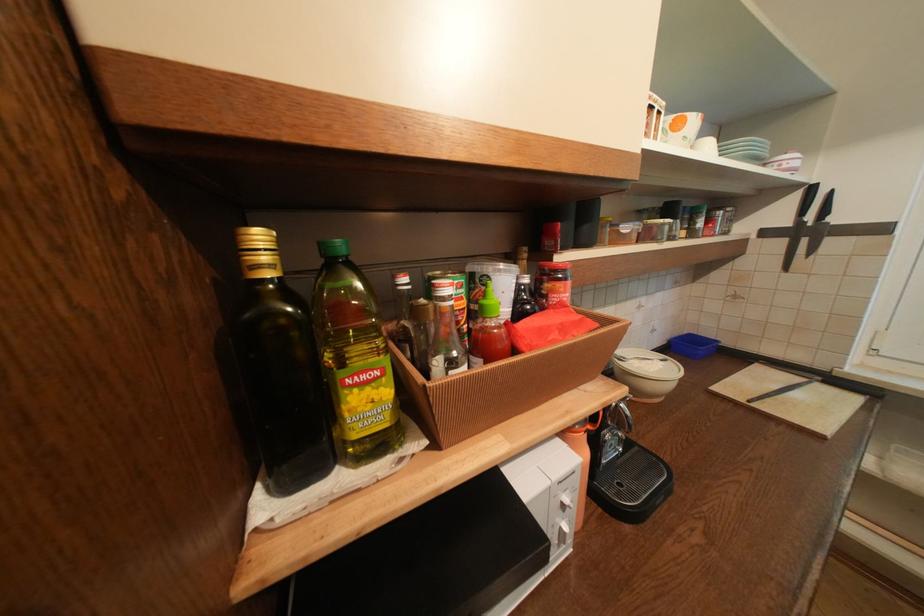
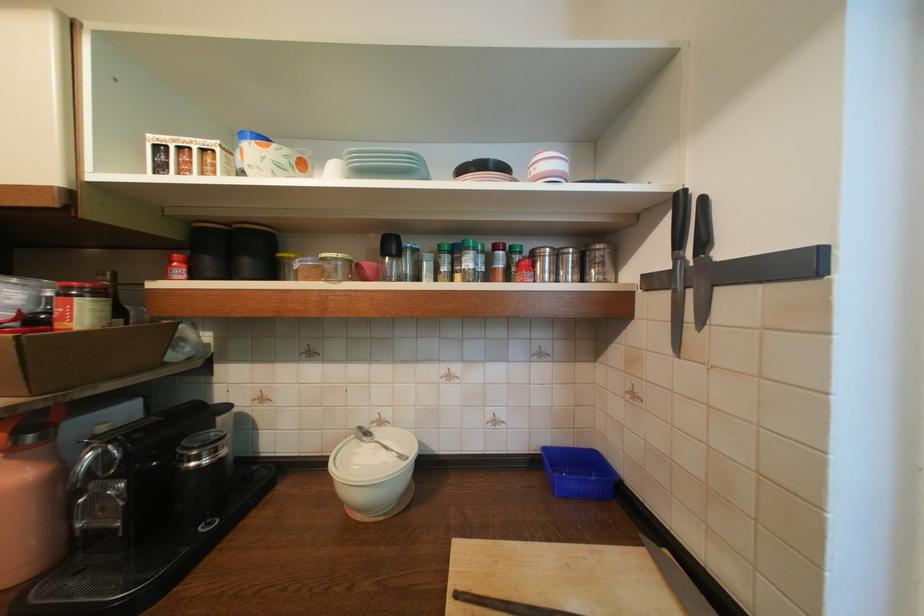
In the second image, find the point that corresponds to pixel 738 222 in the first image.

(611, 265)